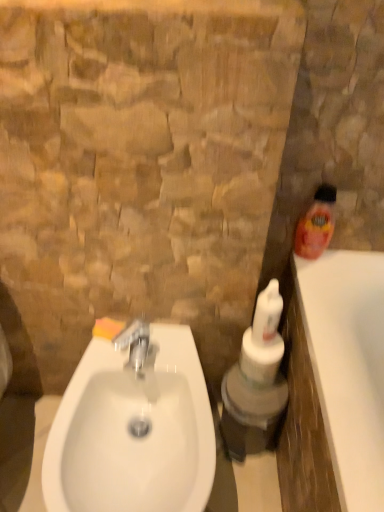
What do you see at coordinates (107, 328) in the screenshot? The width and height of the screenshot is (384, 512). I see `orange sponge at sink left` at bounding box center [107, 328].

Measure the distance between point (268, 306) and camera.

Point (268, 306) and camera are 38.82 inches apart.

I want to click on white glossy bottle at center, marked as the 2th cleaning product in a right-to-left arrangement, so click(267, 314).

You are a GUI agent. You are given a task and a screenshot of the screen. Output one action in this format:
    pyautogui.click(x=<x>, y=<y>)
    Task: Click on the orange plastic bottle at right, the second cleaning product in the left-to-right sequence
    This screenshot has height=512, width=384.
    Given the screenshot: What is the action you would take?
    pyautogui.click(x=316, y=224)

From a real-world perspective, is orange plastic bottle at right, the 2th cleaning product from the bottom, positioned under silver metallic faucet at center based on gravity?

Actually, orange plastic bottle at right, the 2th cleaning product from the bottom, is physically above silver metallic faucet at center in the real world.

Is orange plastic bottle at right, which ranks as the first cleaning product in top-to-bottom order, far from silver metallic faucet at center?

No.

From the image's perspective, is orange plastic bottle at right, the second cleaning product in the left-to-right sequence, above silver metallic faucet at center?

Yes, from the image's perspective, orange plastic bottle at right, the second cleaning product in the left-to-right sequence, is over silver metallic faucet at center.

Can you tell me how much orange plastic bottle at right, the second cleaning product in the left-to-right sequence, and silver metallic faucet at center differ in facing direction?

The facing directions of orange plastic bottle at right, the second cleaning product in the left-to-right sequence, and silver metallic faucet at center are 0.947 degrees apart.

Is orange sponge at sink left turned away from silver metallic faucet at center?

orange sponge at sink left does not have its back to silver metallic faucet at center.

Considering the sizes of objects orange sponge at sink left and silver metallic faucet at center in the image provided, who is taller, orange sponge at sink left or silver metallic faucet at center?

With more height is silver metallic faucet at center.

Locate an element on the screen. This screenshot has width=384, height=512. tap on the right of the orange sponge at sink left is located at coordinates (139, 356).

Considering the sizes of objects silver metallic faucet at center and orange sponge at sink left in the image provided, who is wider, silver metallic faucet at center or orange sponge at sink left?

silver metallic faucet at center is wider.

From a real-world perspective, which object stands above the other?

From a 3D spatial view, silver metallic faucet at center is above.

In the image, is silver metallic faucet at center positioned in front of or behind orange sponge at sink left?

In the image, silver metallic faucet at center appears in front of orange sponge at sink left.

Which of these two, silver metallic faucet at center or orange sponge at sink left, stands shorter?

Standing shorter between the two is orange sponge at sink left.

Can you tell me how much orange plastic bottle at right, which ranks as the first cleaning product in top-to-bottom order, and white glossy bottle at center, marked as the 1th cleaning product in a left-to-right arrangement, differ in facing direction?

There is a 1.72-degree angle between the facing directions of orange plastic bottle at right, which ranks as the first cleaning product in top-to-bottom order, and white glossy bottle at center, marked as the 1th cleaning product in a left-to-right arrangement.

From the image's perspective, which one is positioned higher, orange plastic bottle at right, the 2th cleaning product from the bottom, or white glossy bottle at center, which is the 2th cleaning product in top-to-bottom order?

orange plastic bottle at right, the 2th cleaning product from the bottom.

Is orange plastic bottle at right, the second cleaning product in the left-to-right sequence, oriented towards white glossy bottle at center, marked as the 2th cleaning product in a right-to-left arrangement?

No, orange plastic bottle at right, the second cleaning product in the left-to-right sequence, is not turned towards white glossy bottle at center, marked as the 2th cleaning product in a right-to-left arrangement.

Is orange plastic bottle at right, which ranks as the first cleaning product in top-to-bottom order, situated inside white glossy bottle at center, marked as the 2th cleaning product in a right-to-left arrangement, or outside?

orange plastic bottle at right, which ranks as the first cleaning product in top-to-bottom order, is located beyond the bounds of white glossy bottle at center, marked as the 2th cleaning product in a right-to-left arrangement.

From a real-world perspective, is silver metallic faucet at center positioned above or below white glossy bottle at center, the first cleaning product when ordered from bottom to top?

silver metallic faucet at center is below white glossy bottle at center, the first cleaning product when ordered from bottom to top.

Do you think silver metallic faucet at center is within white glossy bottle at center, marked as the 1th cleaning product in a left-to-right arrangement, or outside of it?

silver metallic faucet at center is outside white glossy bottle at center, marked as the 1th cleaning product in a left-to-right arrangement.

Between silver metallic faucet at center and white glossy bottle at center, marked as the 1th cleaning product in a left-to-right arrangement, which one is positioned behind?

white glossy bottle at center, marked as the 1th cleaning product in a left-to-right arrangement.

In terms of height, does silver metallic faucet at center look taller or shorter compared to white glossy bottle at center, which is the 2th cleaning product in top-to-bottom order?

Clearly, silver metallic faucet at center is shorter compared to white glossy bottle at center, which is the 2th cleaning product in top-to-bottom order.

Is white glossy sink at lower left aimed at white glossy bottle at center, marked as the 2th cleaning product in a right-to-left arrangement?

No, white glossy sink at lower left is not oriented towards white glossy bottle at center, marked as the 2th cleaning product in a right-to-left arrangement.

Does point (88, 433) appear closer or farther from the camera than point (265, 343)?

Point (88, 433) is closer to the camera than point (265, 343).

From a real-world perspective, is white glossy sink at lower left physically below white glossy bottle at center, the first cleaning product when ordered from bottom to top?

Yes.

From the white glossy sink at lower left, count 1st cleaning products backward and point to it. Please provide its 2D coordinates.

[(267, 314)]

From the image's perspective, which object appears higher, white glossy bottle at center, marked as the 1th cleaning product in a left-to-right arrangement, or orange sponge at sink left?

white glossy bottle at center, marked as the 1th cleaning product in a left-to-right arrangement.

Measure the distance between white glossy bottle at center, the first cleaning product when ordered from bottom to top, and orange sponge at sink left.

They are 13.61 inches apart.

Does point (264, 330) lie behind point (114, 321)?

No.

The width and height of the screenshot is (384, 512). I want to click on the 1st cleaning product above when counting from the orange sponge at sink left (from the image's perspective), so click(267, 314).

From the image's perspective, count 2nd cleaning products upward from the silver metallic faucet at center and point to it. Please provide its 2D coordinates.

[(316, 224)]

Where is `tap located on the right of orange sponge at sink left`? tap located on the right of orange sponge at sink left is located at coordinates (139, 356).

From the image, which object appears to be nearer to orange sponge at sink left, orange plastic bottle at right, the 2th cleaning product from the bottom, or white glossy sink at lower left?

white glossy sink at lower left is positioned closer to the anchor orange sponge at sink left.

When comparing their distances from silver metallic faucet at center, does white glossy bottle at center, marked as the 2th cleaning product in a right-to-left arrangement, or white glossy sink at lower left seem closer?

Based on the image, white glossy sink at lower left appears to be nearer to silver metallic faucet at center.

Looking at the image, which one is located closer to orange plastic bottle at right, the 1th cleaning product viewed from the right, silver metallic faucet at center or white glossy sink at lower left?

Among the two, silver metallic faucet at center is located nearer to orange plastic bottle at right, the 1th cleaning product viewed from the right.

When comparing their distances from silver metallic faucet at center, does orange sponge at sink left or orange plastic bottle at right, the second cleaning product in the left-to-right sequence, seem closer?

orange sponge at sink left.

Based on the photo, estimate the real-world distances between objects in this image. Which object is closer to orange sponge at sink left, orange plastic bottle at right, the 2th cleaning product from the bottom, or white glossy bottle at center, which is the 2th cleaning product in top-to-bottom order?

white glossy bottle at center, which is the 2th cleaning product in top-to-bottom order, is closer to orange sponge at sink left.

Based on the photo, based on their spatial positions, is white glossy bottle at center, marked as the 1th cleaning product in a left-to-right arrangement, or orange sponge at sink left closer to silver metallic faucet at center?

orange sponge at sink left.

Which object lies further to the anchor point white glossy sink at lower left, orange plastic bottle at right, the 2th cleaning product from the bottom, or orange sponge at sink left?

orange plastic bottle at right, the 2th cleaning product from the bottom.

When comparing their distances from silver metallic faucet at center, does white glossy sink at lower left or orange plastic bottle at right, which ranks as the first cleaning product in top-to-bottom order, seem further?

Based on the image, orange plastic bottle at right, which ranks as the first cleaning product in top-to-bottom order, appears to be further to silver metallic faucet at center.

At what (x,y) coordinates should I click in order to perform the action: click on tap between orange sponge at sink left and white glossy sink at lower left vertically. Please return your answer as a coordinate pair (x, y). This screenshot has height=512, width=384. Looking at the image, I should click on (139, 356).

I want to click on cleaning product situated between silver metallic faucet at center and orange plastic bottle at right, the 2th cleaning product from the bottom, from left to right, so click(x=267, y=314).

Find the location of a particular element. This screenshot has width=384, height=512. tap situated between orange sponge at sink left and orange plastic bottle at right, the 2th cleaning product from the bottom, from left to right is located at coordinates (139, 356).

The image size is (384, 512). In order to click on sink between orange sponge at sink left and white glossy bottle at center, marked as the 2th cleaning product in a right-to-left arrangement in this screenshot , I will do `click(133, 432)`.